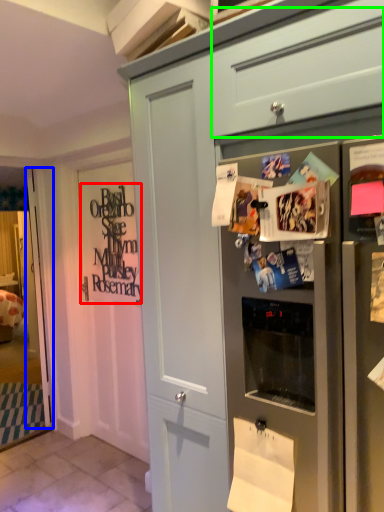
Question: Which is nearer to the signature (highlighted by a red box)? door (highlighted by a blue box) or drawer (highlighted by a green box).

Choices:
 (A) door
 (B) drawer

Answer: (A)